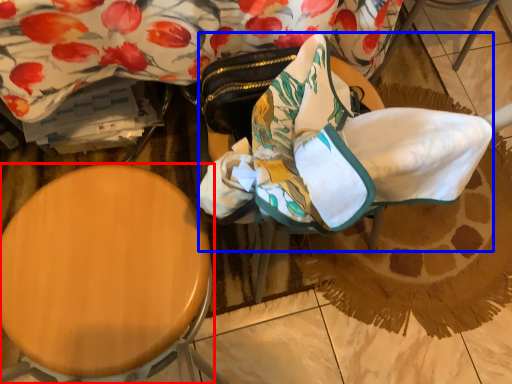
Question: Which object appears closest to the camera in this image, furniture (highlighted by a red box) or swivel chair (highlighted by a blue box)?

Choices:
 (A) furniture
 (B) swivel chair

Answer: (A)